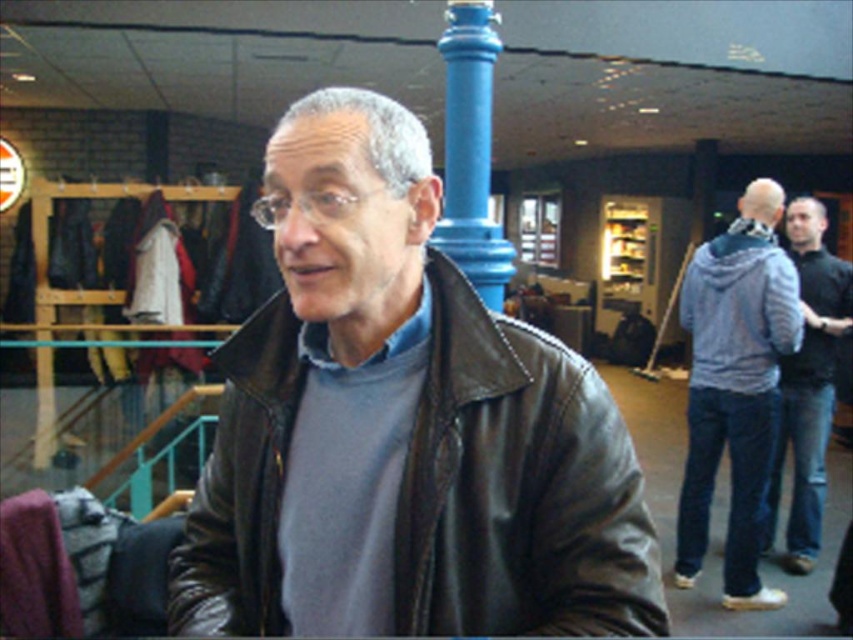
You are a fashion designer analyzing the image. You need to determine which item is shorter between the black leather jacket at center and the dark blue jeans at right. Which one is shorter?

The black leather jacket at center is shorter than the dark blue jeans at right.

You are a security guard in a mall. You need to check the distance between the dark blue jeans at right and the blue painted metal pole at center. Can you confirm if the distance is more than 6 feet?

The dark blue jeans at right is 7.09 feet away from the blue painted metal pole at center, so yes, the distance is more than 6 feet.

You are a security guard in the mall and need to locate the light blue hoodie at right and the blue painted metal pole at center. Which object is positioned to the right of the other?

The light blue hoodie at right is positioned to the right of the blue painted metal pole at center.